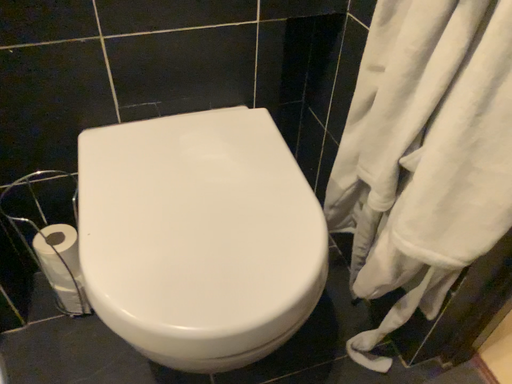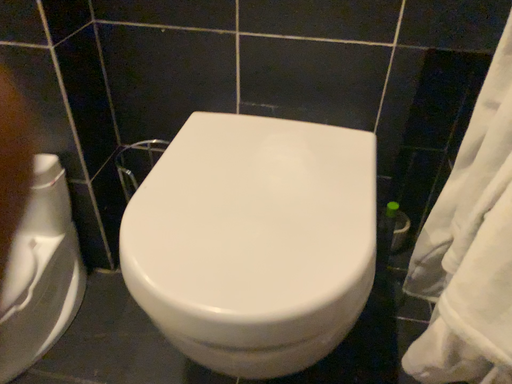
Question: Which way did the camera rotate in the video?

Choices:
 (A) rotated right
 (B) rotated left

Answer: (B)